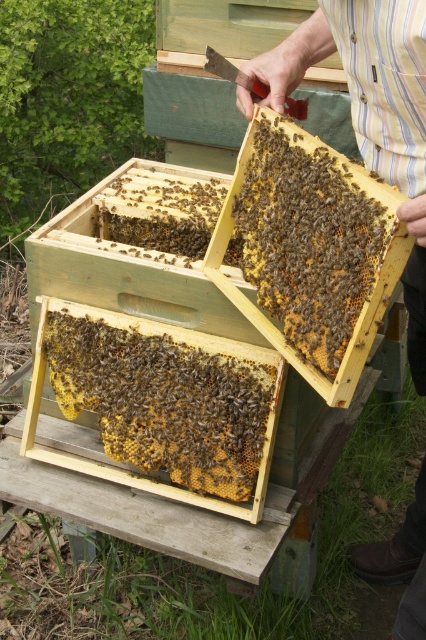
Describe the element at coordinates (310, 250) in the screenshot. This screenshot has height=640, width=426. I see `beehive at center` at that location.

Between beehive at center and brown fuzzy honeycomb at center, which one has less height?

brown fuzzy honeycomb at center is shorter.

I want to click on beehive at center, so click(310, 250).

In the scene shown: Who is higher up, brown wax comb at center or striped cotton shirt at upper center?

striped cotton shirt at upper center is higher up.

Is brown wax comb at center taller than striped cotton shirt at upper center?

In fact, brown wax comb at center may be shorter than striped cotton shirt at upper center.

Does point (198, 413) come behind point (376, 132)?

That is True.

At what (x,y) coordinates should I click in order to perform the action: click on brown wax comb at center. Please return your answer as a coordinate pair (x, y). The width and height of the screenshot is (426, 640). Looking at the image, I should click on (166, 400).

Does brown wax comb at center have a larger size compared to brown fuzzy honeycomb at center?

Yes, brown wax comb at center is bigger than brown fuzzy honeycomb at center.

Is point (95, 378) in front of point (154, 193)?

Yes, it is in front of point (154, 193).

This screenshot has width=426, height=640. What do you see at coordinates (166, 400) in the screenshot?
I see `brown wax comb at center` at bounding box center [166, 400].

What are the coordinates of `brown wax comb at center` in the screenshot? It's located at (166, 400).